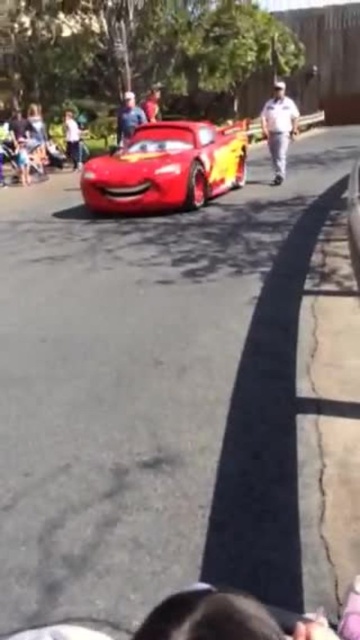
Question: Which object appears closest to the camera in this image?

Choices:
 (A) matte red car at center
 (B) blue denim shirt at center
 (C) shiny red car at center
 (D) matte red shirt at upper center

Answer: (C)

Question: Does shiny red car at center appear on the left side of white uniform at center?

Choices:
 (A) no
 (B) yes

Answer: (B)

Question: Among these objects, which one is nearest to the camera?

Choices:
 (A) matte red car at center
 (B) white uniform at center
 (C) matte red shirt at upper center
 (D) shiny red car at center

Answer: (D)

Question: Observing the image, what is the correct spatial positioning of blue denim shirt at center in reference to matte red car at center?

Choices:
 (A) right
 (B) left

Answer: (A)

Question: Is shiny red car at center below white uniform at center?

Choices:
 (A) yes
 (B) no

Answer: (A)

Question: Which point is closer to the camera?

Choices:
 (A) shiny red car at center
 (B) white uniform at center
 (C) matte red car at center

Answer: (A)